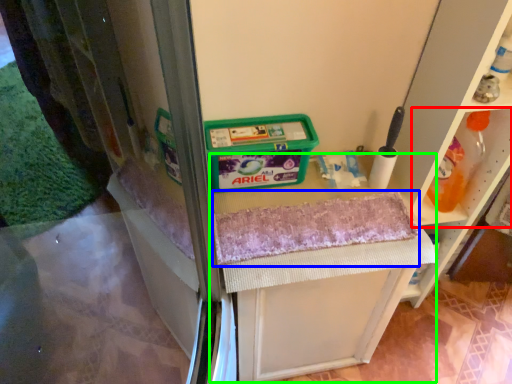
Question: Estimate the real-world distances between objects in this image. Which object is farther from shelf (highlighted by a red box), bath towel (highlighted by a blue box) or vanity (highlighted by a green box)?

Choices:
 (A) bath towel
 (B) vanity

Answer: (B)